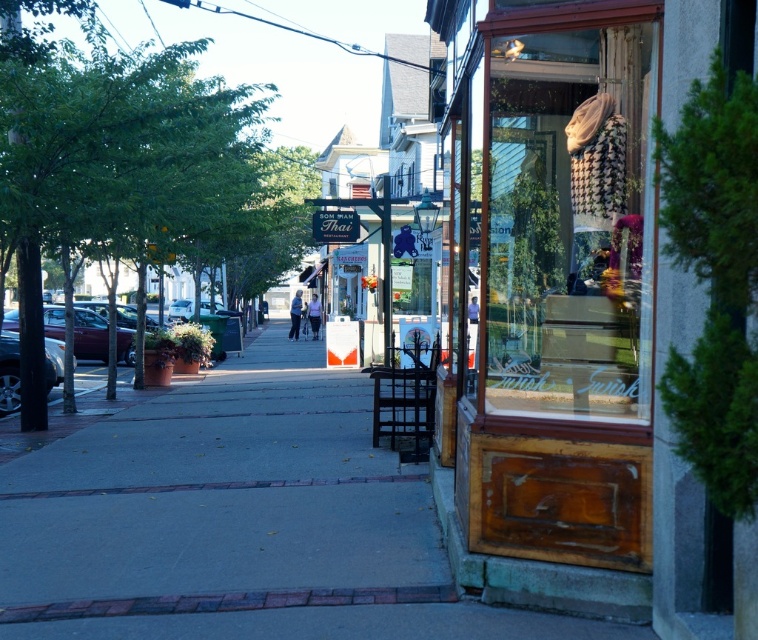
Question: Which point is closer to the camera taking this photo?

Choices:
 (A) (637, 220)
 (B) (121, 340)

Answer: (A)

Question: Which point is closer to the camera?

Choices:
 (A) (606, 145)
 (B) (60, 324)

Answer: (A)

Question: Can you confirm if wooden display case at center is bigger than shiny maroon sedan at left?

Choices:
 (A) yes
 (B) no

Answer: (B)

Question: Does wooden display case at center appear over shiny maroon sedan at left?

Choices:
 (A) no
 (B) yes

Answer: (B)

Question: Which of the following is the closest to the observer?

Choices:
 (A) (55, 323)
 (B) (611, 337)

Answer: (B)

Question: Does wooden display case at center appear over shiny maroon sedan at left?

Choices:
 (A) no
 (B) yes

Answer: (B)